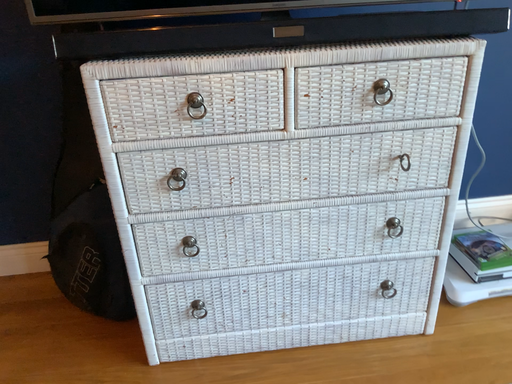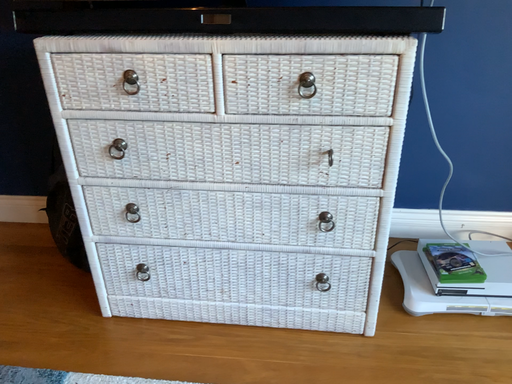
Question: How did the camera likely rotate when shooting the video?

Choices:
 (A) rotated left
 (B) rotated right

Answer: (A)